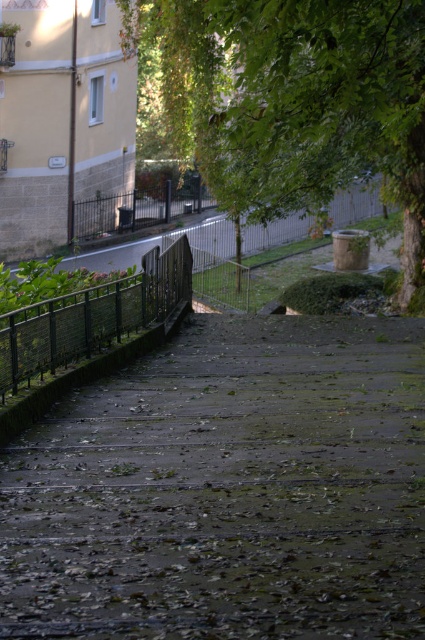
Question: Which object appears closest to the camera in this image?

Choices:
 (A) green leafy tree at upper center
 (B) dark gray concrete stairs at center
 (C) green metal fence at left

Answer: (B)

Question: Can you confirm if green leafy tree at upper center is wider than green metal fence at left?

Choices:
 (A) no
 (B) yes

Answer: (B)

Question: From the image, what is the correct spatial relationship of green leafy tree at upper center in relation to green metal fence at left?

Choices:
 (A) below
 (B) above

Answer: (B)

Question: Is dark gray concrete stairs at center above green leafy tree at upper center?

Choices:
 (A) yes
 (B) no

Answer: (B)

Question: Which object is positioned farthest from the dark gray concrete stairs at center?

Choices:
 (A) green metal fence at left
 (B) green leafy tree at upper center

Answer: (B)

Question: Which of the following is the closest to the observer?

Choices:
 (A) dark gray concrete stairs at center
 (B) green leafy tree at upper center
 (C) green metal fence at left

Answer: (A)